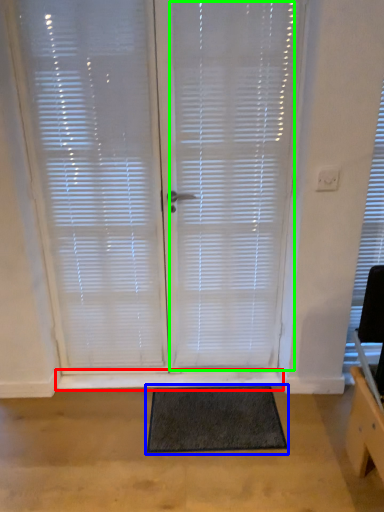
Question: Estimate the real-world distances between objects in this image. Which object is farther from window sill (highlighted by a red box), doormat (highlighted by a blue box) or blind (highlighted by a green box)?

Choices:
 (A) doormat
 (B) blind

Answer: (B)